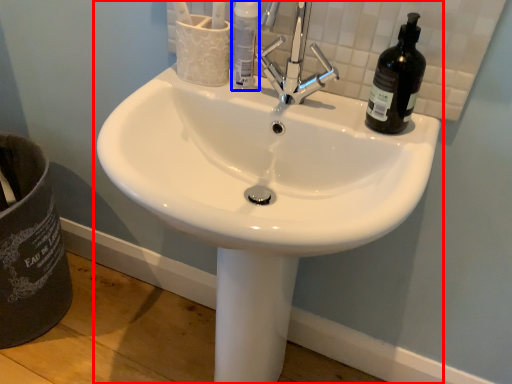
Question: Which object appears farthest to the camera in this image, sink (highlighted by a red box) or bottle (highlighted by a blue box)?

Choices:
 (A) sink
 (B) bottle

Answer: (B)